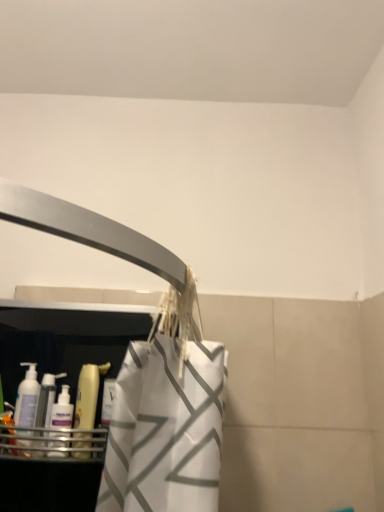
Question: Considering the relative sizes of translucent plastic bottle at left, arranged as the second cleaning product when viewed from the right, and translucent plastic bottle at left, the first cleaning product positioned from the right, in the image provided, is translucent plastic bottle at left, arranged as the second cleaning product when viewed from the right, wider than translucent plastic bottle at left, the first cleaning product positioned from the right,?

Choices:
 (A) no
 (B) yes

Answer: (B)

Question: From a real-world perspective, is translucent plastic bottle at left, arranged as the second cleaning product when viewed from the right, physically below translucent plastic bottle at left, which ranks as the second cleaning product in left-to-right order?

Choices:
 (A) no
 (B) yes

Answer: (B)

Question: Considering the relative sizes of translucent plastic bottle at left, arranged as the second cleaning product when viewed from the right, and translucent plastic bottle at left, which ranks as the second cleaning product in left-to-right order, in the image provided, is translucent plastic bottle at left, arranged as the second cleaning product when viewed from the right, thinner than translucent plastic bottle at left, which ranks as the second cleaning product in left-to-right order,?

Choices:
 (A) yes
 (B) no

Answer: (B)

Question: Is translucent plastic bottle at left, the first cleaning product positioned from the right, located within translucent plastic bottle at left, which is counted as the 1th cleaning product, starting from the left?

Choices:
 (A) yes
 (B) no

Answer: (B)

Question: Is translucent plastic bottle at left, which is counted as the 1th cleaning product, starting from the left, taller than translucent plastic bottle at left, which ranks as the second cleaning product in left-to-right order?

Choices:
 (A) no
 (B) yes

Answer: (A)

Question: Is the surface of translucent plastic bottle at left, which is counted as the 1th cleaning product, starting from the left, in direct contact with translucent plastic bottle at left, which ranks as the second cleaning product in left-to-right order?

Choices:
 (A) yes
 (B) no

Answer: (A)

Question: Is translucent plastic bottle at left, the first cleaning product positioned from the right, completely or partially outside of translucent plastic bottle at left, arranged as the second cleaning product when viewed from the right?

Choices:
 (A) yes
 (B) no

Answer: (A)

Question: Is translucent plastic bottle at left, which ranks as the second cleaning product in left-to-right order, at the right side of translucent plastic bottle at left, which is counted as the 1th cleaning product, starting from the left?

Choices:
 (A) yes
 (B) no

Answer: (A)

Question: Is translucent plastic bottle at left, the first cleaning product positioned from the right, facing towards translucent plastic bottle at left, which is counted as the 1th cleaning product, starting from the left?

Choices:
 (A) no
 (B) yes

Answer: (A)

Question: From the image's perspective, is translucent plastic bottle at left, the first cleaning product positioned from the right, on top of translucent plastic bottle at left, which is counted as the 1th cleaning product, starting from the left?

Choices:
 (A) yes
 (B) no

Answer: (A)

Question: Is translucent plastic bottle at left, which ranks as the second cleaning product in left-to-right order, not near translucent plastic bottle at left, arranged as the second cleaning product when viewed from the right?

Choices:
 (A) no
 (B) yes

Answer: (A)

Question: Could translucent plastic bottle at left, which is counted as the 1th cleaning product, starting from the left, be considered to be inside translucent plastic bottle at left, the first cleaning product positioned from the right?

Choices:
 (A) no
 (B) yes

Answer: (A)

Question: In the image, is translucent plastic bottle at left, which ranks as the second cleaning product in left-to-right order, on the left side or the right side of translucent plastic bottle at left, arranged as the second cleaning product when viewed from the right?

Choices:
 (A) left
 (B) right

Answer: (B)